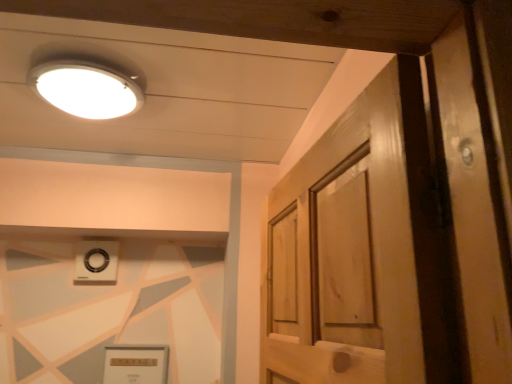
Question: Is white plastic knob at upper center surrounding white glossy light fixture at upper left?

Choices:
 (A) yes
 (B) no

Answer: (B)

Question: Can you confirm if white plastic knob at upper center is wider than white glossy light fixture at upper left?

Choices:
 (A) yes
 (B) no

Answer: (B)

Question: Does white plastic knob at upper center appear on the left side of white glossy light fixture at upper left?

Choices:
 (A) no
 (B) yes

Answer: (B)

Question: Is white plastic knob at upper center further to camera compared to white glossy light fixture at upper left?

Choices:
 (A) no
 (B) yes

Answer: (B)

Question: From the image's perspective, is white plastic knob at upper center under white glossy light fixture at upper left?

Choices:
 (A) no
 (B) yes

Answer: (B)

Question: Considering the relative sizes of white plastic knob at upper center and white glossy light fixture at upper left in the image provided, is white plastic knob at upper center bigger than white glossy light fixture at upper left?

Choices:
 (A) yes
 (B) no

Answer: (B)

Question: From a real-world perspective, is matte gold picture frame at lower center on top of white plastic knob at upper center?

Choices:
 (A) no
 (B) yes

Answer: (A)

Question: Is matte gold picture frame at lower center to the right of white plastic knob at upper center from the viewer's perspective?

Choices:
 (A) no
 (B) yes

Answer: (B)

Question: From the image's perspective, is matte gold picture frame at lower center located above white plastic knob at upper center?

Choices:
 (A) no
 (B) yes

Answer: (A)

Question: From a real-world perspective, is matte gold picture frame at lower center located beneath white plastic knob at upper center?

Choices:
 (A) no
 (B) yes

Answer: (B)

Question: Considering the relative positions of matte gold picture frame at lower center and white plastic knob at upper center in the image provided, is matte gold picture frame at lower center behind white plastic knob at upper center?

Choices:
 (A) yes
 (B) no

Answer: (B)

Question: Considering the relative sizes of matte gold picture frame at lower center and white plastic knob at upper center in the image provided, is matte gold picture frame at lower center smaller than white plastic knob at upper center?

Choices:
 (A) yes
 (B) no

Answer: (B)

Question: Considering the relative sizes of white glossy light fixture at upper left and matte gold picture frame at lower center in the image provided, is white glossy light fixture at upper left thinner than matte gold picture frame at lower center?

Choices:
 (A) no
 (B) yes

Answer: (A)